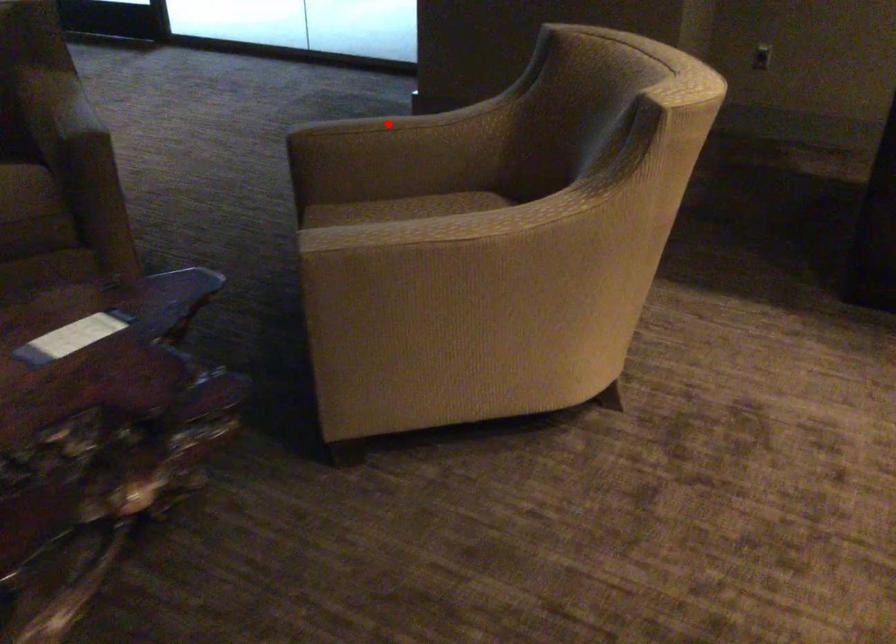
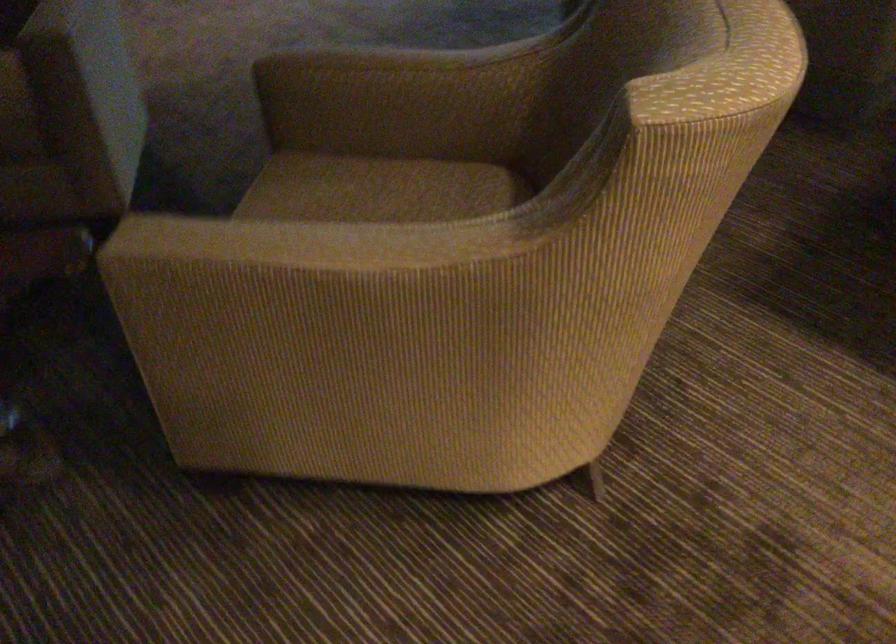
In the second image, find the point that corresponds to the highlighted location in the first image.

(380, 61)